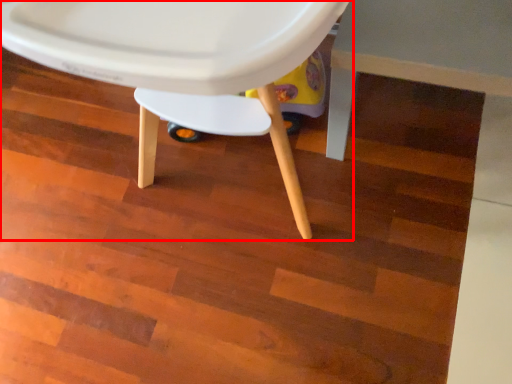
Question: From the image's perspective, what is the correct spatial positioning of chair (annotated by the red box) in reference to table?

Choices:
 (A) above
 (B) below

Answer: (A)